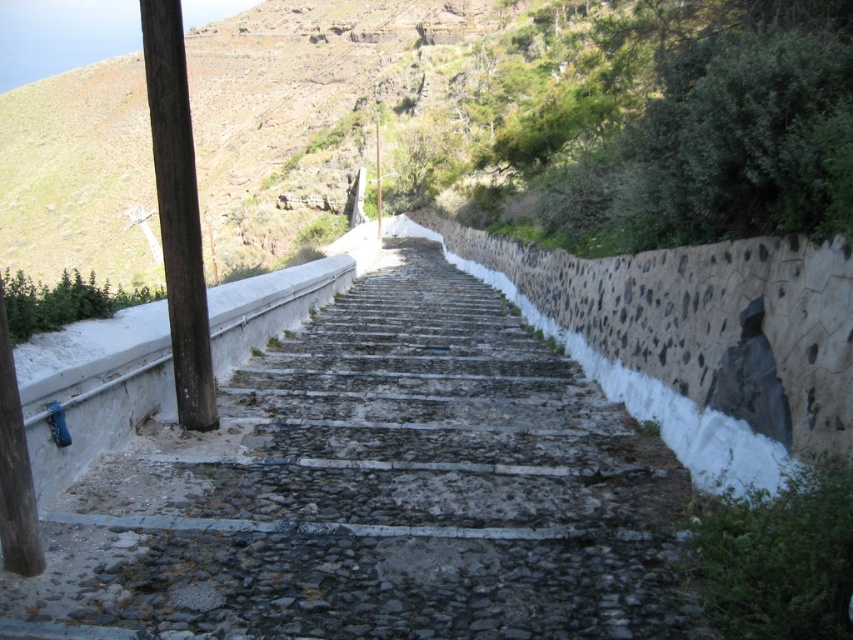
Question: Which object appears closest to the camera in this image?

Choices:
 (A) rough stone steps at center
 (B) brown wood post at left

Answer: (A)

Question: Does rough stone steps at center have a smaller size compared to brown wood post at left?

Choices:
 (A) no
 (B) yes

Answer: (B)

Question: Does rough stone steps at center have a larger size compared to brown wood post at left?

Choices:
 (A) no
 (B) yes

Answer: (A)

Question: Is rough stone steps at center wider than brown wood post at left?

Choices:
 (A) no
 (B) yes

Answer: (B)